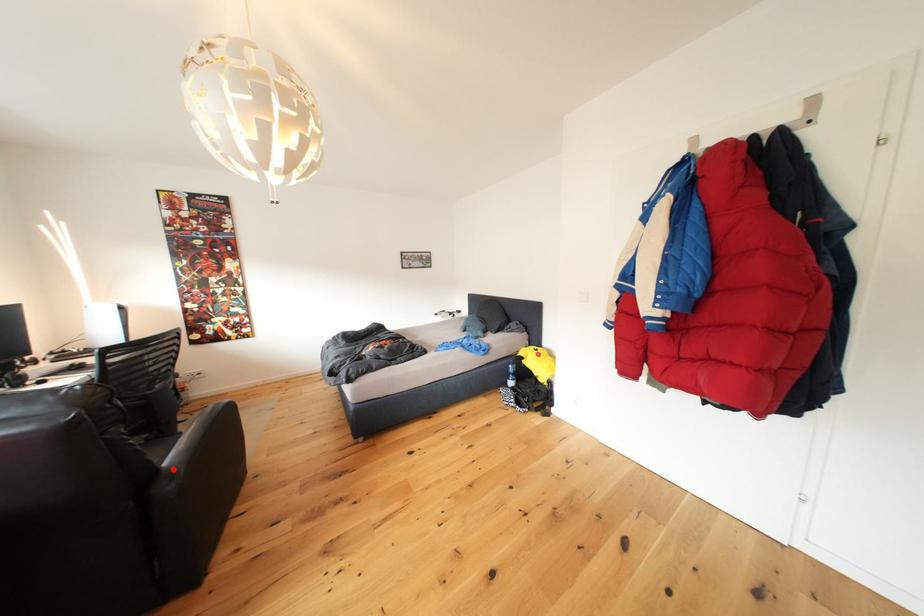
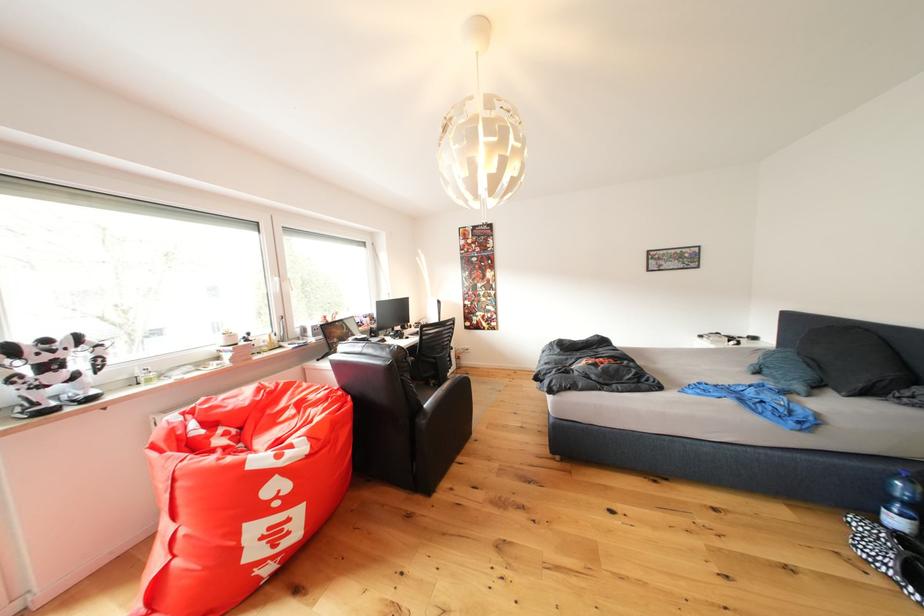
Question: I am providing you with two images of the same scene from different viewpoints. A red point is shown in image1. For the corresponding object point in image2, is it positioned nearer or farther from the camera?

Choices:
 (A) Nearer
 (B) Farther

Answer: (A)